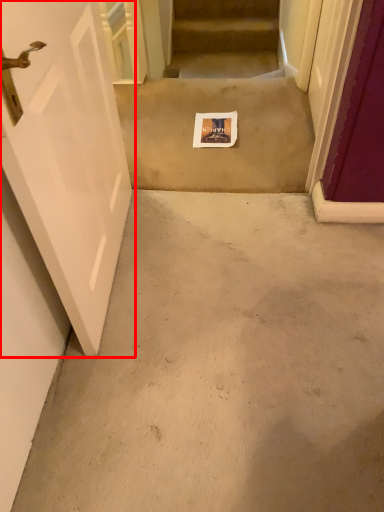
Question: From the image's perspective, what is the correct spatial relationship of door (annotated by the red box) in relation to escalator?

Choices:
 (A) below
 (B) above

Answer: (A)